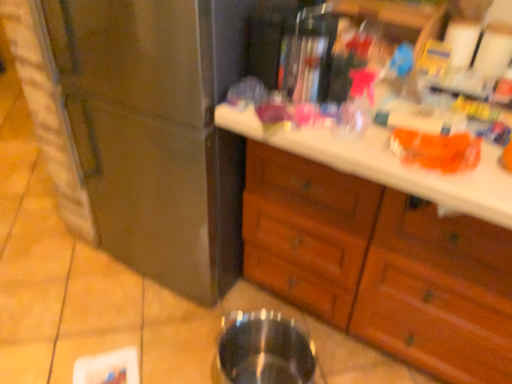
Measure the distance between wooden drawers at center and camera.

The depth of wooden drawers at center is 34.34 inches.

Where is `stainless steel refrigerator at left`? The image size is (512, 384). stainless steel refrigerator at left is located at coordinates (157, 132).

This screenshot has height=384, width=512. I want to click on transparent glass at lower center, so click(264, 350).

Identify the location of wooden drawers at center. The height and width of the screenshot is (384, 512). (381, 244).

Is stainless steel refrigerator at left not close to wooden drawers at center?

stainless steel refrigerator at left is actually quite close to wooden drawers at center.

From the image's perspective, is stainless steel refrigerator at left above wooden drawers at center?

Indeed, from the image's perspective, stainless steel refrigerator at left is shown above wooden drawers at center.

Choose the correct answer: Is stainless steel refrigerator at left inside wooden drawers at center or outside it?

The correct answer is: outside.

Identify the location of refrigerator behind the wooden drawers at center. Image resolution: width=512 pixels, height=384 pixels. (157, 132).

Consider the image. Considering the sizes of wooden drawers at center and stainless steel refrigerator at left in the image, is wooden drawers at center taller or shorter than stainless steel refrigerator at left?

Clearly, wooden drawers at center is shorter compared to stainless steel refrigerator at left.

Considering the relative sizes of wooden drawers at center and stainless steel refrigerator at left in the image provided, is wooden drawers at center wider than stainless steel refrigerator at left?

No, wooden drawers at center is not wider than stainless steel refrigerator at left.

Is wooden drawers at center turned away from stainless steel refrigerator at left?

No, stainless steel refrigerator at left is not at the back of wooden drawers at center.

Does stainless steel refrigerator at left lie behind transparent glass at lower center?

No, the depth of stainless steel refrigerator at left is less than that of transparent glass at lower center.

Which is in front, point (201, 146) or point (262, 327)?

Positioned in front is point (201, 146).

Can you confirm if stainless steel refrigerator at left is positioned to the right of transparent glass at lower center?

In fact, stainless steel refrigerator at left is to the left of transparent glass at lower center.

Is stainless steel refrigerator at left not near transparent glass at lower center?

stainless steel refrigerator at left is near transparent glass at lower center, not far away.

How many degrees apart are the facing directions of wooden drawers at center and transparent glass at lower center?

The facing directions of wooden drawers at center and transparent glass at lower center are 4.68 degrees apart.

From a real-world perspective, is wooden drawers at center physically located above or below transparent glass at lower center?

Clearly, from a real-world perspective, wooden drawers at center is above transparent glass at lower center.

Considering the relative sizes of wooden drawers at center and transparent glass at lower center in the image provided, is wooden drawers at center smaller than transparent glass at lower center?

Actually, wooden drawers at center might be larger than transparent glass at lower center.

From the image's perspective, who appears lower, transparent glass at lower center or wooden drawers at center?

transparent glass at lower center appears lower in the image.

Is transparent glass at lower center inside or outside of wooden drawers at center?

transparent glass at lower center is not inside wooden drawers at center, it's outside.

Consider the image. Is transparent glass at lower center looking in the opposite direction of wooden drawers at center?

Yes, transparent glass at lower center is positioned with its back facing wooden drawers at center.

Does transparent glass at lower center come in front of wooden drawers at center?

No, it is behind wooden drawers at center.

Is stainless steel refrigerator at left completely or partially inside transparent glass at lower center?

No, stainless steel refrigerator at left is not surrounded by transparent glass at lower center.

Considering the relative sizes of transparent glass at lower center and stainless steel refrigerator at left in the image provided, is transparent glass at lower center smaller than stainless steel refrigerator at left?

Yes, transparent glass at lower center is smaller than stainless steel refrigerator at left.

Considering the relative sizes of transparent glass at lower center and stainless steel refrigerator at left in the image provided, is transparent glass at lower center taller than stainless steel refrigerator at left?

No, transparent glass at lower center is not taller than stainless steel refrigerator at left.

The height and width of the screenshot is (384, 512). I want to click on cabinetry lying on the right of stainless steel refrigerator at left, so click(381, 244).

This screenshot has width=512, height=384. What are the coordinates of `cabinetry that is in front of the stainless steel refrigerator at left` in the screenshot? It's located at (381, 244).

Which object lies further to the anchor point wooden drawers at center, transparent glass at lower center or stainless steel refrigerator at left?

stainless steel refrigerator at left lies further to wooden drawers at center than the other object.

Looking at the image, which one is located further to transparent glass at lower center, wooden drawers at center or stainless steel refrigerator at left?

stainless steel refrigerator at left lies further to transparent glass at lower center than the other object.

Estimate the real-world distances between objects in this image. Which object is further from wooden drawers at center, stainless steel refrigerator at left or transparent glass at lower center?

stainless steel refrigerator at left is further to wooden drawers at center.

Based on their spatial positions, is transparent glass at lower center or wooden drawers at center further from stainless steel refrigerator at left?

transparent glass at lower center.

From the image, which object appears to be nearer to transparent glass at lower center, stainless steel refrigerator at left or wooden drawers at center?

wooden drawers at center is closer to transparent glass at lower center.

Looking at the image, which one is located closer to stainless steel refrigerator at left, wooden drawers at center or transparent glass at lower center?

wooden drawers at center.

The height and width of the screenshot is (384, 512). Identify the location of cabinetry that lies between stainless steel refrigerator at left and transparent glass at lower center from top to bottom. (381, 244).